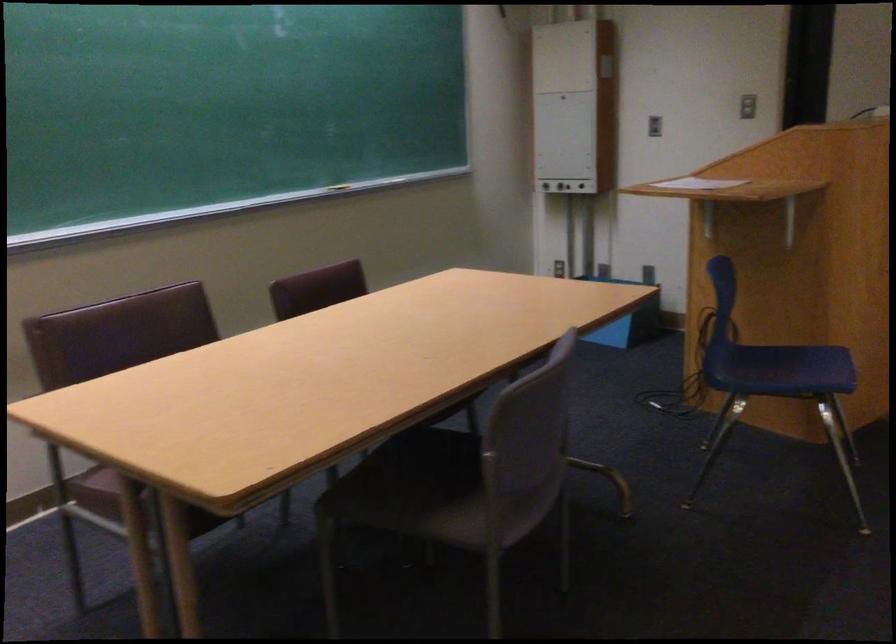
What are the coordinates of `grey chair sitting surface` in the screenshot? It's located at (454, 487).